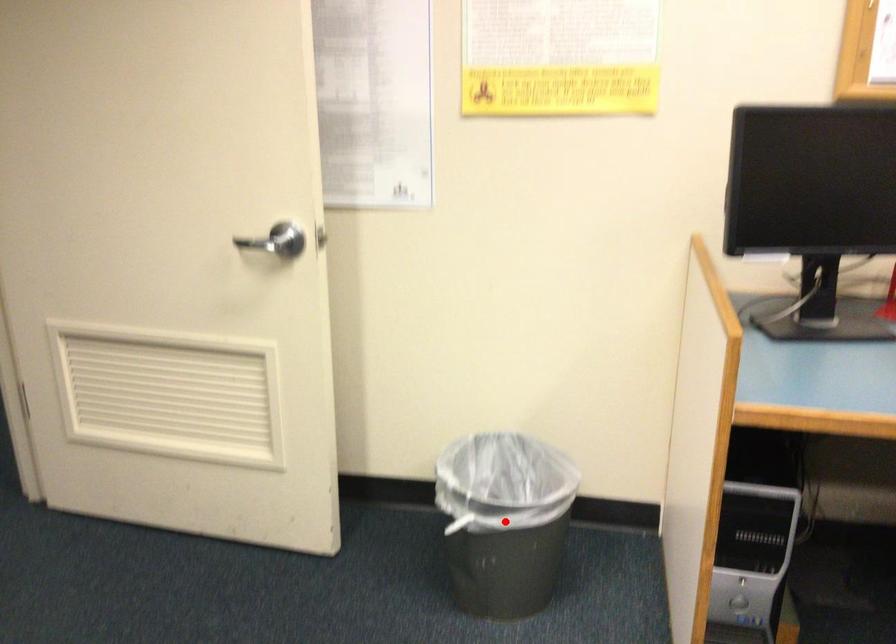
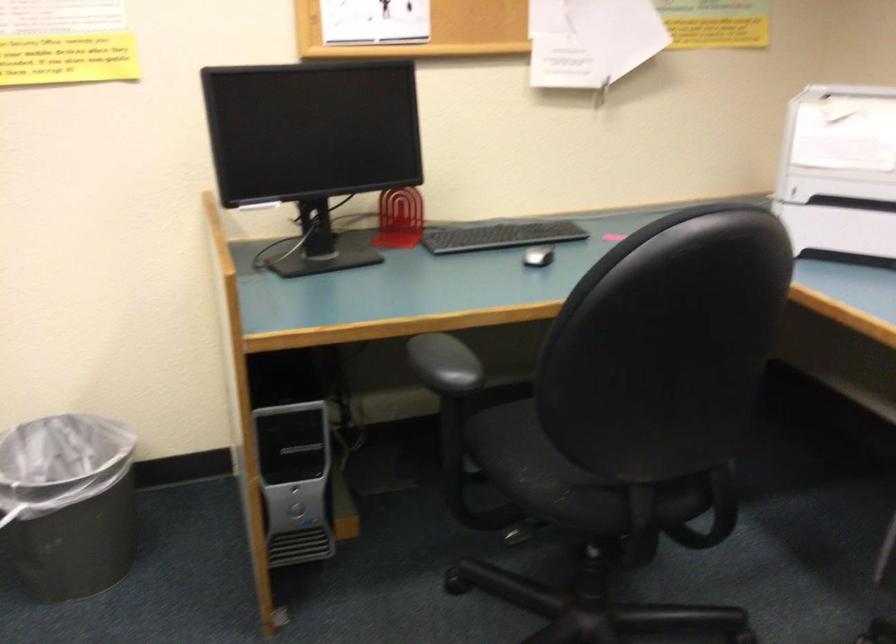
Find the pixel in the second image that matches the highlighted location in the first image.

(67, 504)